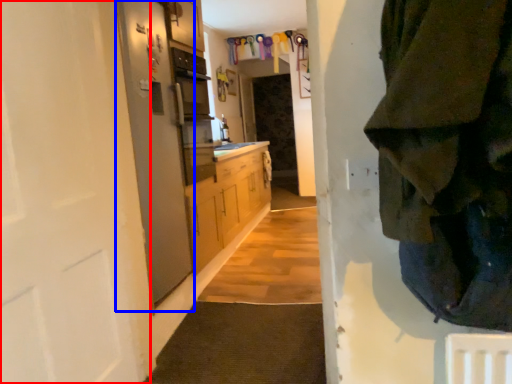
Question: Among these objects, which one is farthest to the camera, door (highlighted by a red box) or screen door (highlighted by a blue box)?

Choices:
 (A) door
 (B) screen door

Answer: (B)